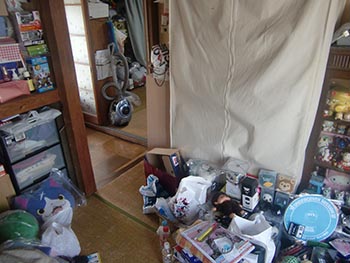
Locate an element on the screen. cat pillow is located at coordinates (41, 198), (54, 206).